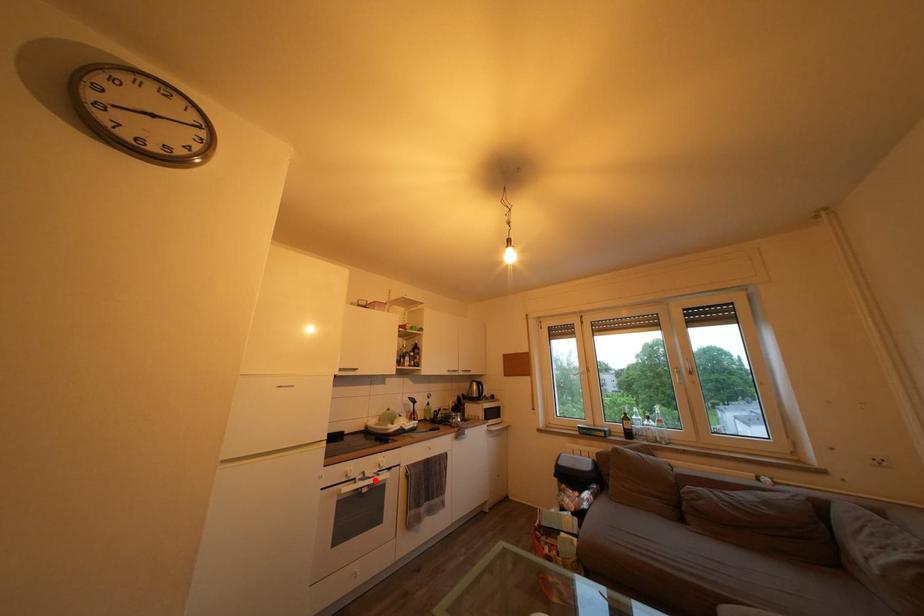
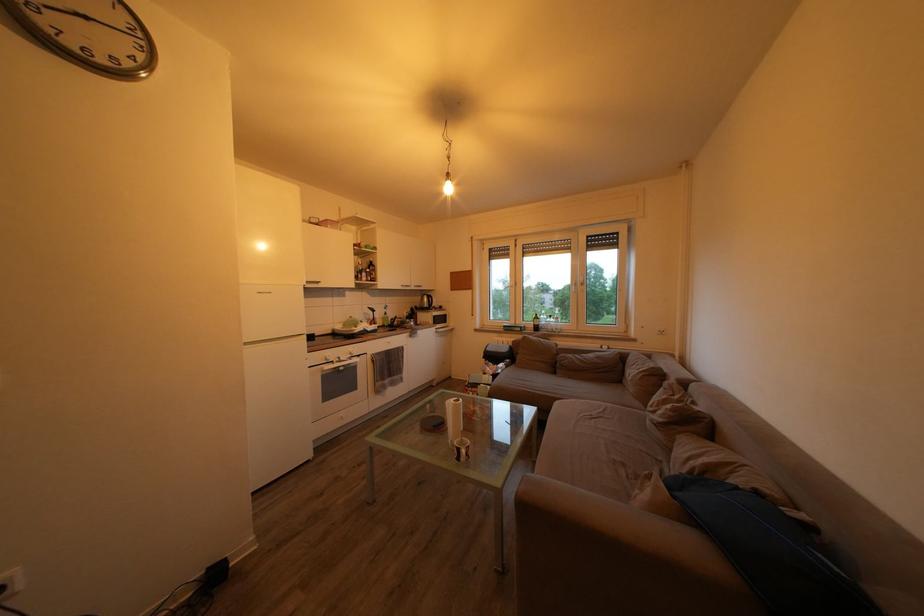
Locate, in the second image, the point that corresponds to the highlighted location in the first image.

(349, 363)